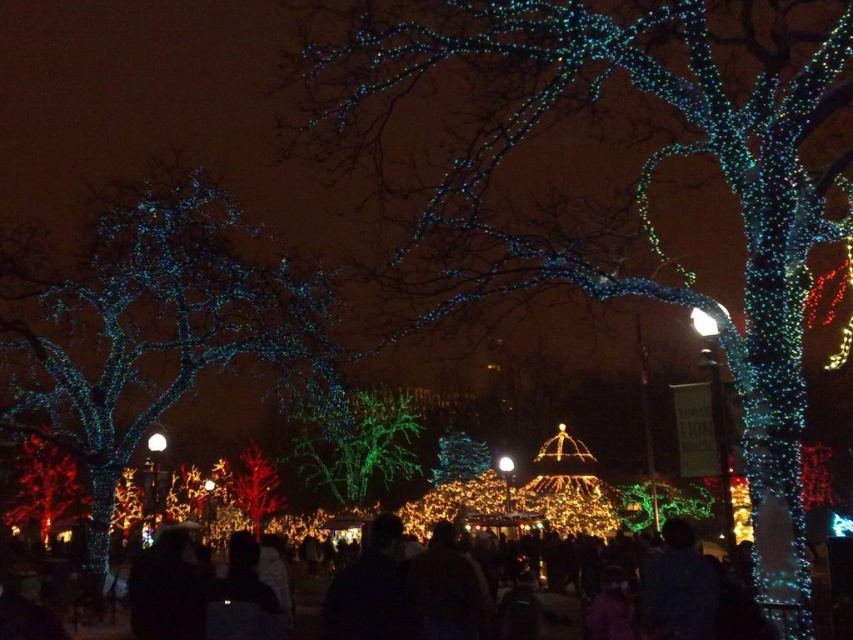
Question: Which object is the closest to the shiny red tree at center?

Choices:
 (A) white glossy light at center
 (B) iridescent glass tree at center

Answer: (B)

Question: Which of these objects is positioned farthest from the green matte tree at center?

Choices:
 (A) iridescent glass tree at center
 (B) white matte light at center
 (C) illuminated wire at left
 (D) white glossy light at center

Answer: (B)

Question: Can you confirm if iridescent glass tree at center is positioned to the right of white glossy light at center?

Choices:
 (A) no
 (B) yes

Answer: (A)

Question: Considering the real-world distances, which object is closest to the white matte light at center?

Choices:
 (A) illuminated wire at left
 (B) iridescent glass tree at center
 (C) white glossy light at center

Answer: (A)

Question: Is illuminated wire at left further to the viewer compared to shiny red tree at center?

Choices:
 (A) no
 (B) yes

Answer: (A)

Question: Is illuminated wire at left to the right of green matte tree at center from the viewer's perspective?

Choices:
 (A) no
 (B) yes

Answer: (A)